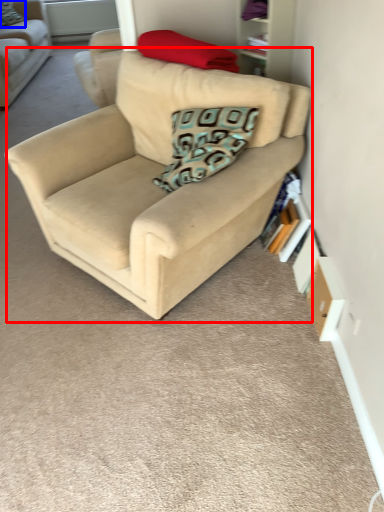
Question: Which of the following is the farthest to the observer, studio couch (highlighted by a red box) or pillow (highlighted by a blue box)?

Choices:
 (A) studio couch
 (B) pillow

Answer: (B)